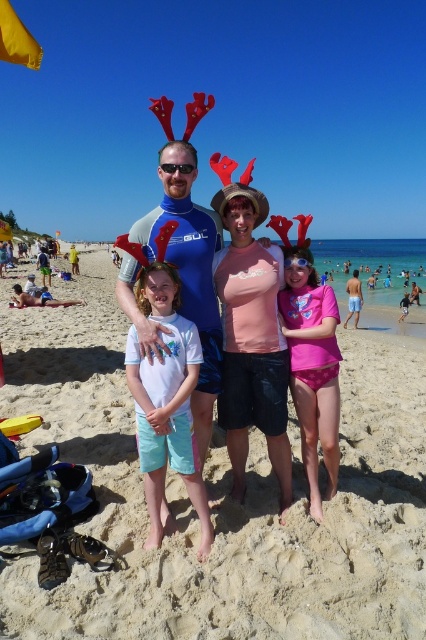
From the picture: You are a photographer trying to capture the pink polka dot swimsuit at center in your shot. However, the beige sandy beach at center is blocking your view. Can you adjust your camera angle to see the swimsuit without moving the objects?

The beige sandy beach at center is in front of the pink polka dot swimsuit at center, so you can lower your camera angle to look under the sandy beach or move to the side to get a clear view of the swimsuit.